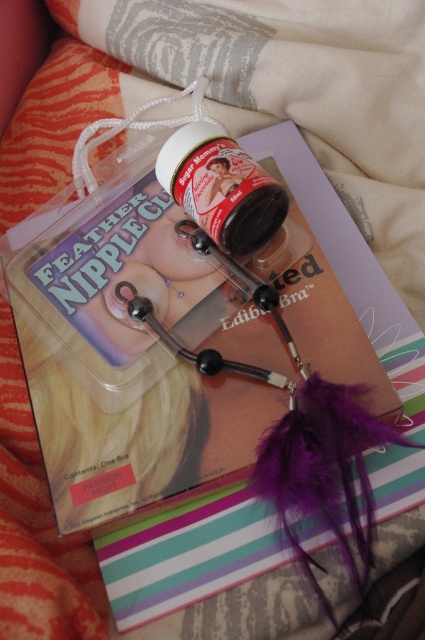
Question: Among these objects, which one is farthest from the camera?

Choices:
 (A) purple feathered magazine at center
 (B) white matte jar at center

Answer: (B)

Question: Can you confirm if purple feathered magazine at center is smaller than white matte jar at center?

Choices:
 (A) yes
 (B) no

Answer: (B)

Question: Is purple feathered magazine at center positioned in front of white matte jar at center?

Choices:
 (A) yes
 (B) no

Answer: (A)

Question: Can you confirm if purple feathered magazine at center is bigger than white matte jar at center?

Choices:
 (A) no
 (B) yes

Answer: (B)

Question: Which object is closer to the camera taking this photo?

Choices:
 (A) purple feathered magazine at center
 (B) white matte jar at center

Answer: (A)

Question: Among these objects, which one is nearest to the camera?

Choices:
 (A) white matte jar at center
 (B) purple feathered magazine at center

Answer: (B)